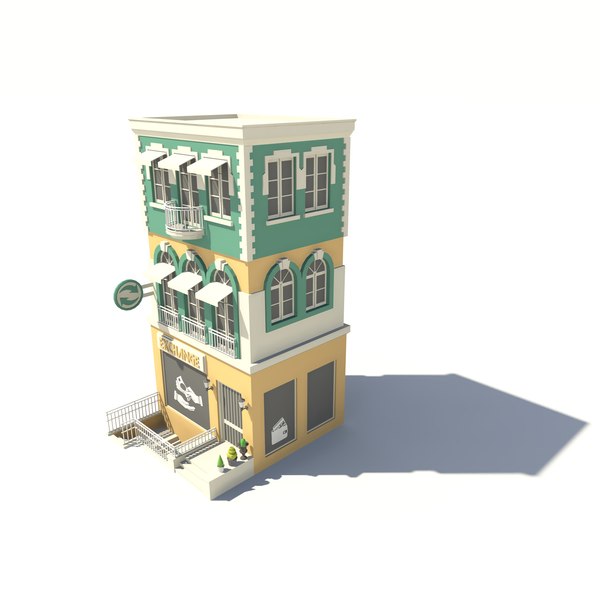
This screenshot has width=600, height=600. I want to click on potted plants, so click(x=242, y=450), click(x=231, y=460), click(x=220, y=468).